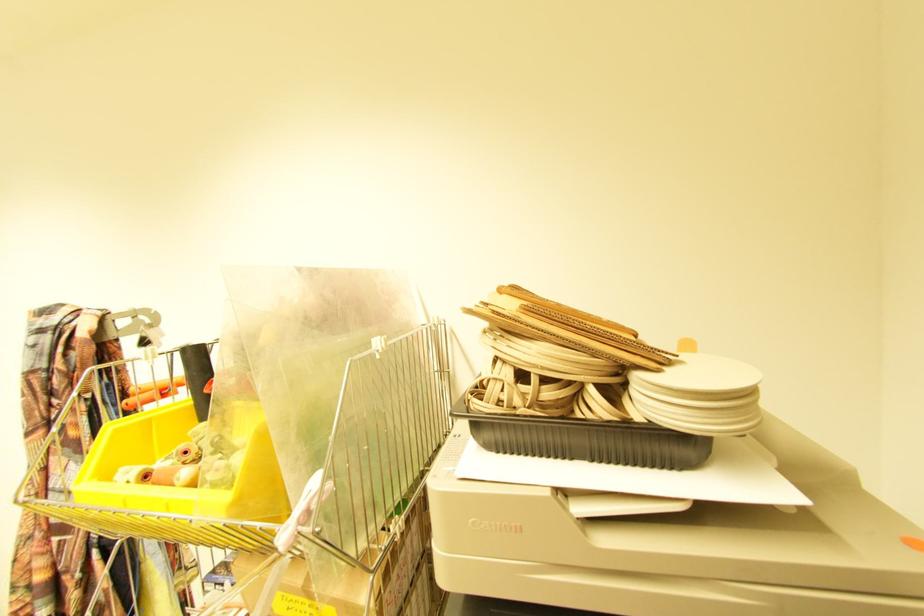
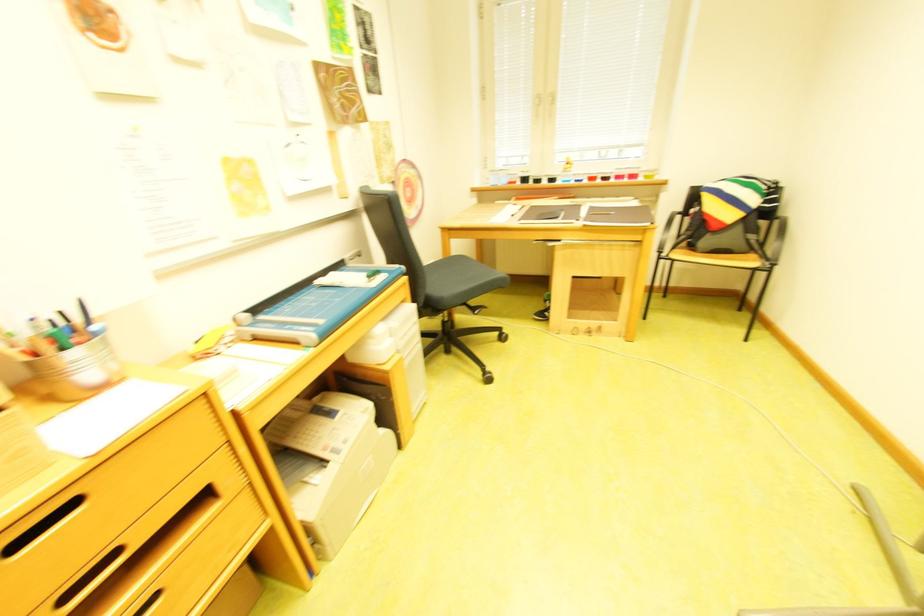
The first image is from the beginning of the video and the second image is from the end. How did the camera likely rotate when shooting the video?

The rotation direction of the camera is left-down.